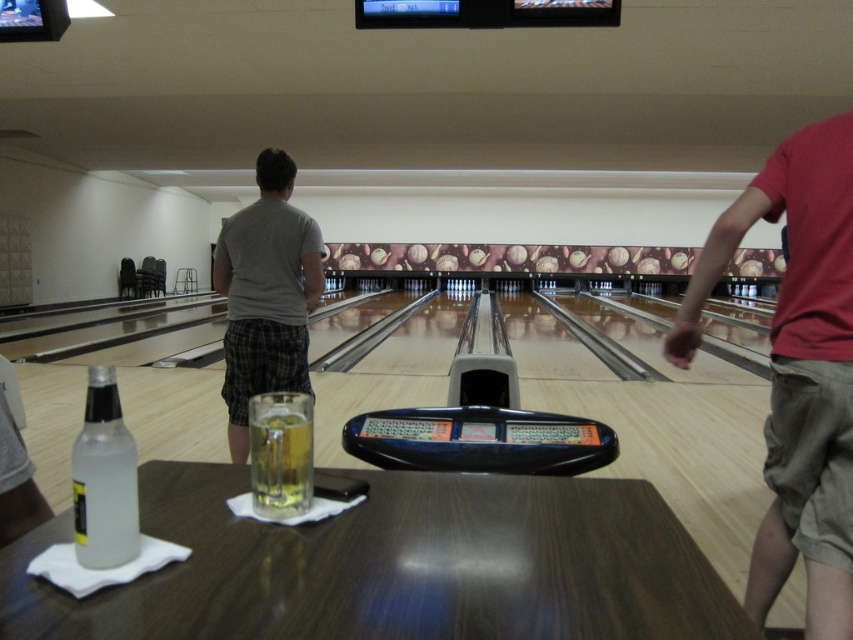
You are standing at the point labeled point (277, 502) in the bowling alley scene. You want to move to the point labeled point (221, 269). Which direction should you walk to reach your destination?

Point (221, 269) is behind point (277, 502), so you should walk backward to reach your destination.